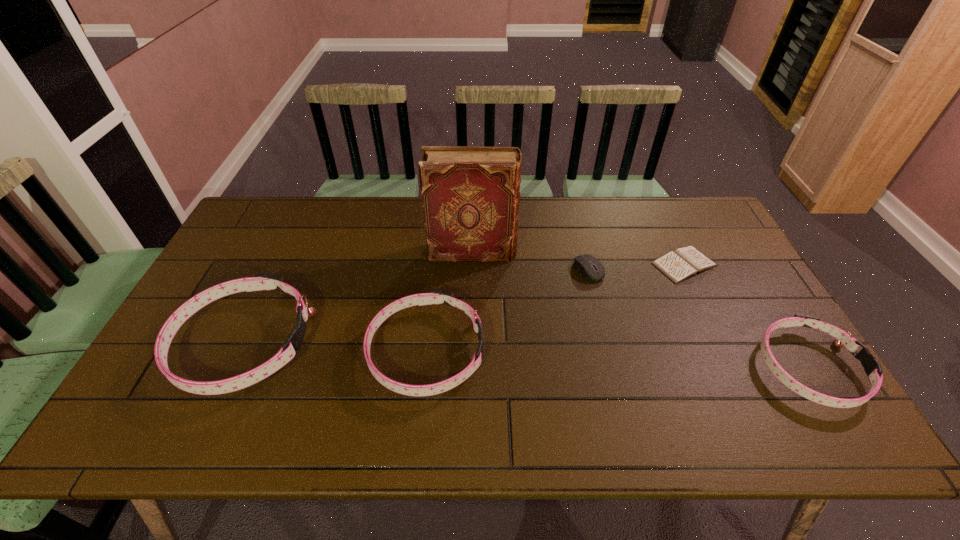
In the image, there is a desktop. Identify the location of blank space at the near edge. (443, 380).

This screenshot has width=960, height=540. I want to click on vacant space at the left edge, so click(199, 312).

Image resolution: width=960 pixels, height=540 pixels. In order to click on vacant area at the right edge in this screenshot , I will do `click(717, 256)`.

This screenshot has width=960, height=540. What are the coordinates of `vacant space at the near left corner of the desktop` in the screenshot? It's located at (153, 386).

In the image, there is a desktop. Identify the location of free space at the far right corner. This screenshot has height=540, width=960. (686, 225).

Find the location of `free spot between the tallest object and the rightmost dog collar`. free spot between the tallest object and the rightmost dog collar is located at coordinates (640, 310).

This screenshot has height=540, width=960. In order to click on unoccupied area between the third tallest object and the computer equipment in this screenshot , I will do `click(507, 310)`.

Identify the location of free space between the rightmost dog collar and the second tallest dog collar. The image size is (960, 540). (617, 360).

You are a GUI agent. You are given a task and a screenshot of the screen. Output one action in this format:
    pyautogui.click(x=<x>, y=<y>)
    Task: Click on the vacant region between the computer equipment and the shortest dog collar
    This screenshot has width=960, height=540.
    Given the screenshot: What is the action you would take?
    pyautogui.click(x=698, y=319)

Where is `free spot between the second tallest dog collar and the second shortest object`? free spot between the second tallest dog collar and the second shortest object is located at coordinates (507, 310).